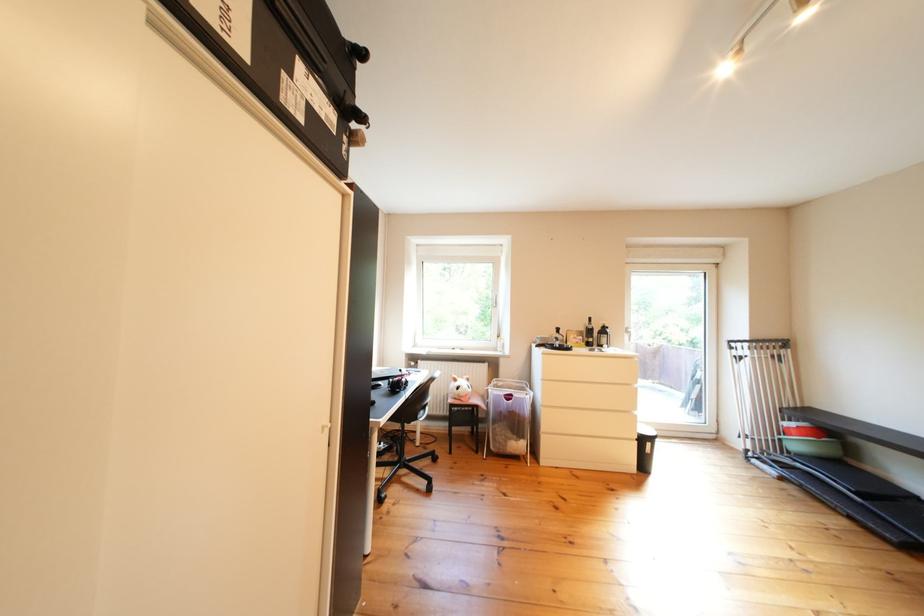
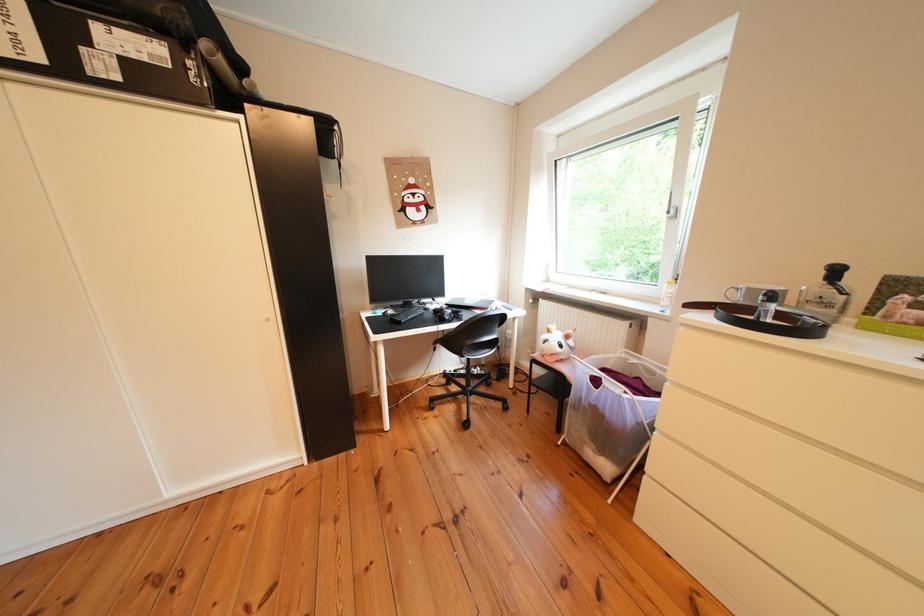
Find the pixel in the second image that matches point (524, 439) in the first image.

(601, 442)